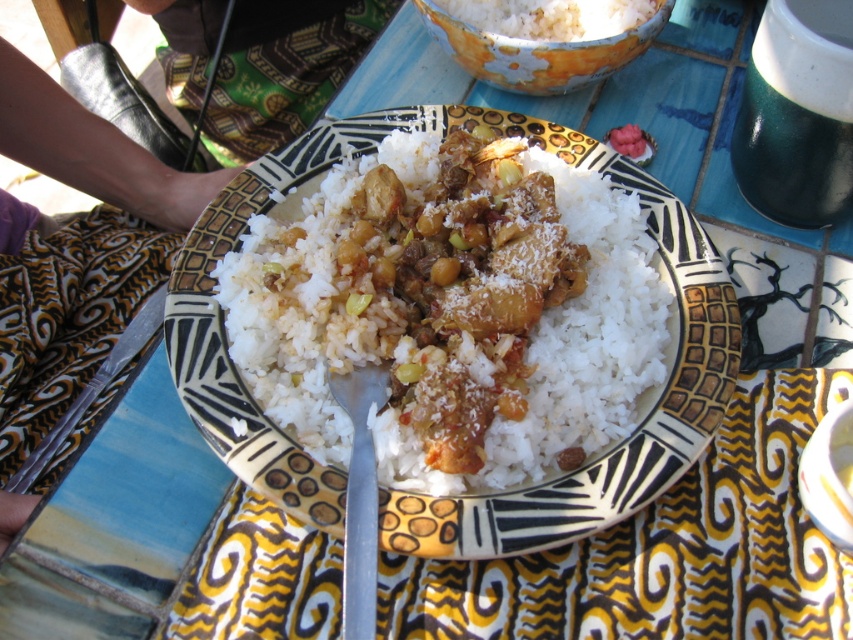
Question: Is speckled ceramic bowl at upper center wider than silver metallic fork at center?

Choices:
 (A) no
 (B) yes

Answer: (B)

Question: Which point is closer to the camera taking this photo?

Choices:
 (A) (360, 392)
 (B) (488, 35)
 (C) (556, 42)
 (D) (422, 492)

Answer: (D)

Question: Is speckled ceramic bowl at upper center above silver metallic fork at center?

Choices:
 (A) no
 (B) yes

Answer: (B)

Question: Among these objects, which one is farthest from the camera?

Choices:
 (A) white matte rice at upper center
 (B) white polished rice at center
 (C) silver metallic fork at center

Answer: (A)

Question: Does silver metallic fork at center appear on the right side of white matte rice at upper center?

Choices:
 (A) no
 (B) yes

Answer: (A)

Question: Which point appears closest to the camera in this image?

Choices:
 (A) (421, 396)
 (B) (453, 8)
 (C) (467, 48)
 (D) (357, 524)

Answer: (D)